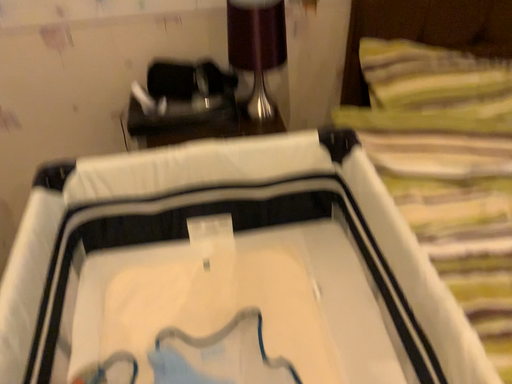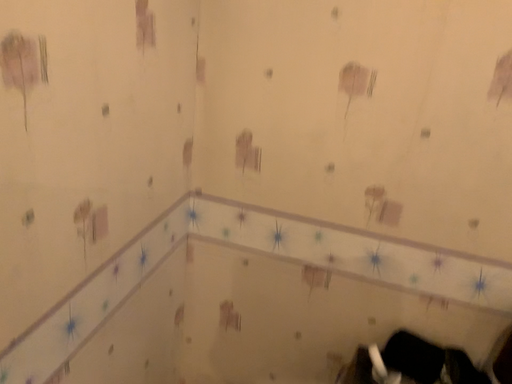
Question: How did the camera likely rotate when shooting the video?

Choices:
 (A) rotated left
 (B) rotated right

Answer: (A)